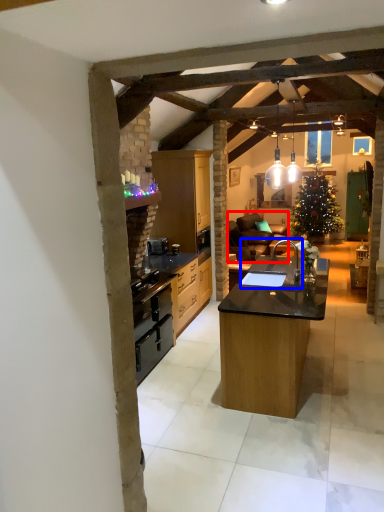
Question: Which point is closer to the camera, studio couch (highlighted by a red box) or sink (highlighted by a blue box)?

Choices:
 (A) studio couch
 (B) sink

Answer: (B)